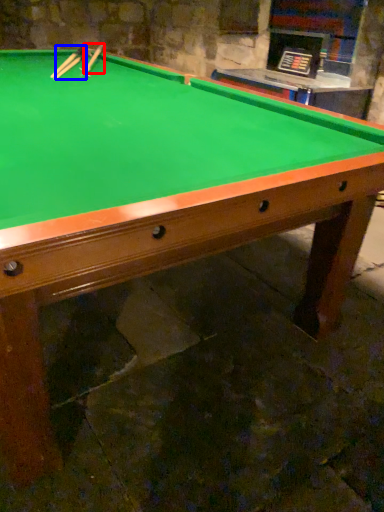
Question: Which object is further to the camera taking this photo, cue (highlighted by a red box) or cue (highlighted by a blue box)?

Choices:
 (A) cue
 (B) cue

Answer: (A)